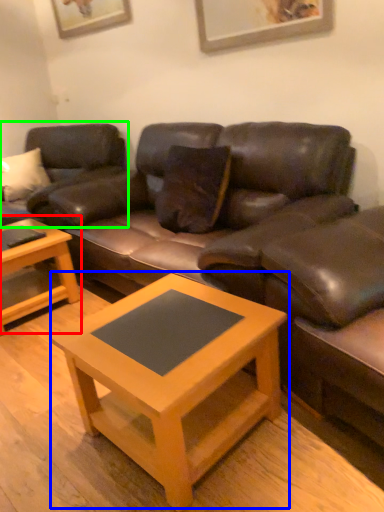
Question: Which object is positioned closest to coffee table (highlighted by a red box)? Select from coffee table (highlighted by a blue box) and studio couch (highlighted by a green box).

Choices:
 (A) coffee table
 (B) studio couch

Answer: (B)